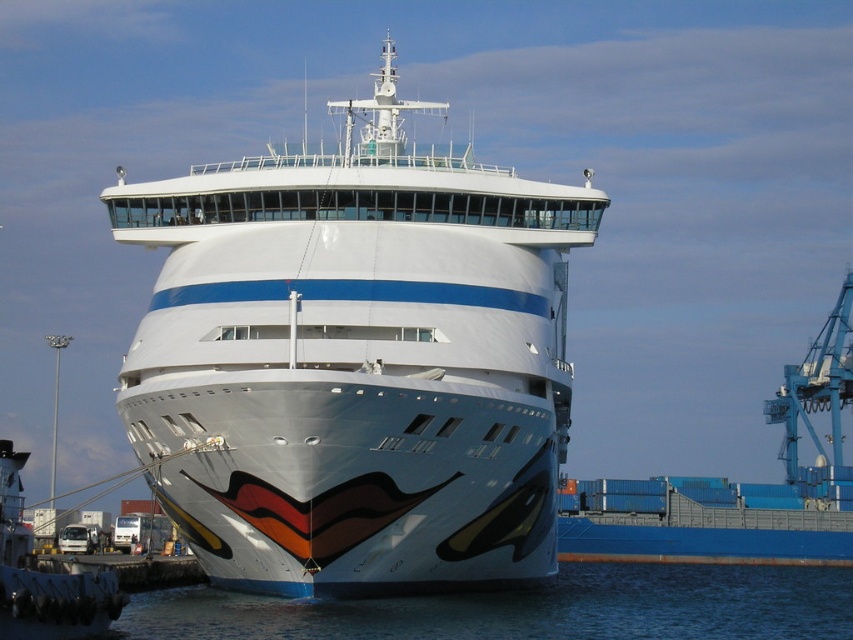
Who is more distant from viewer, (502,342) or (706,621)?

The point (706,621) is behind.

Between white glossy cruise ship at center and blue water at lower center, which one appears on the right side from the viewer's perspective?

From the viewer's perspective, blue water at lower center appears more on the right side.

Which is in front, point (320, 276) or point (627, 577)?

Point (320, 276) is in front.

Where is `white glossy cruise ship at center`? This screenshot has height=640, width=853. white glossy cruise ship at center is located at coordinates (355, 362).

Which is behind, point (790, 588) or point (6, 556)?

The point (790, 588) is more distant.

Does blue water at lower center appear over white glossy ship at center?

No.

Where is `blue water at lower center`? This screenshot has height=640, width=853. blue water at lower center is located at coordinates (531, 609).

Between white glossy cruise ship at center and white glossy ship at center, which one appears on the right side from the viewer's perspective?

Positioned to the right is white glossy cruise ship at center.

Which is behind, point (164, 355) or point (91, 588)?

Point (164, 355)

Identify the location of white glossy cruise ship at center. (355, 362).